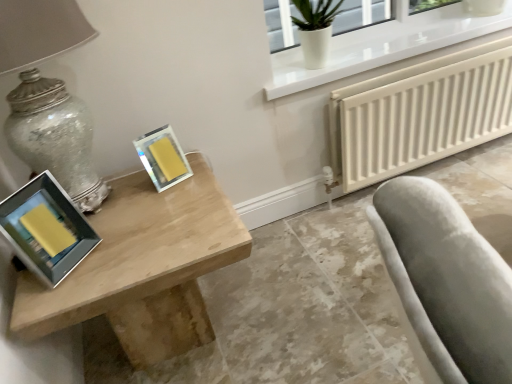
At what (x,y) coordinates should I click in order to perform the action: click on free space in front of matte yellow picture frame at left, the first picture frame from the left. Please return your answer as a coordinate pair (x, y). Looking at the image, I should click on (x=53, y=294).